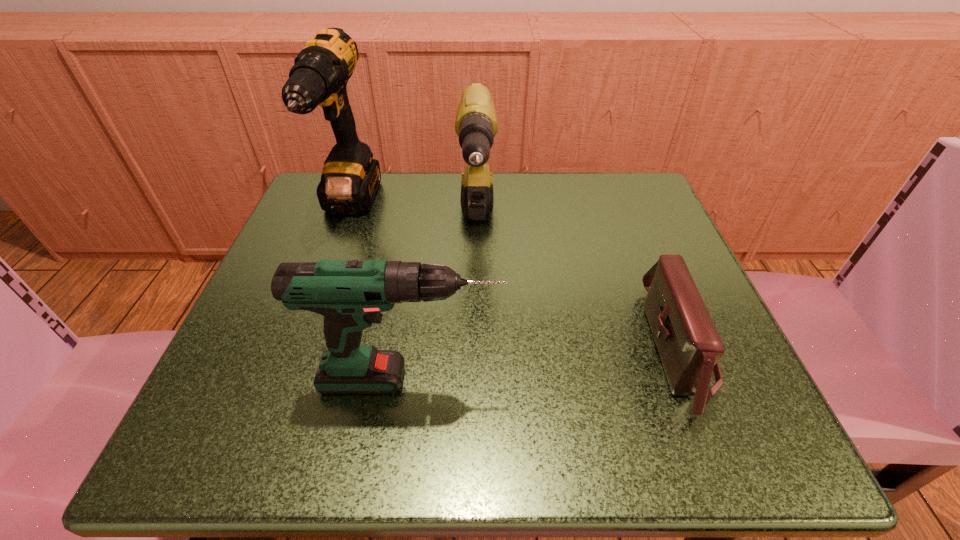
You are a GUI agent. You are given a task and a screenshot of the screen. Output one action in this format:
    pyautogui.click(x=<x>, y=<y>)
    Task: Click on the object located in the right edge section of the desktop
    The image size is (960, 540).
    Given the screenshot: What is the action you would take?
    pyautogui.click(x=689, y=346)

Find the location of `object situated at the far left corner`. object situated at the far left corner is located at coordinates (350, 179).

Locate an element on the screen. The image size is (960, 540). object located at the near right corner is located at coordinates (689, 346).

Identify the location of vacant point at the far edge. The height and width of the screenshot is (540, 960). (533, 204).

The image size is (960, 540). In the image, there is a desktop. Find the location of `vacant space at the near edge`. vacant space at the near edge is located at coordinates (579, 401).

The image size is (960, 540). In the image, there is a desktop. Identify the location of vacant space at the left edge. (222, 386).

The height and width of the screenshot is (540, 960). I want to click on vacant space at the far left corner of the desktop, so click(297, 215).

At what (x,y) coordinates should I click in order to perform the action: click on free point at the far right corner. Please return your answer as a coordinate pair (x, y). Image resolution: width=960 pixels, height=540 pixels. Looking at the image, I should click on (582, 198).

Where is `free space between the shoulder bag and the tallest drill`? The height and width of the screenshot is (540, 960). free space between the shoulder bag and the tallest drill is located at coordinates (514, 279).

Locate an element on the screen. Image resolution: width=960 pixels, height=540 pixels. free area in between the tallest object and the rightmost object is located at coordinates (514, 279).